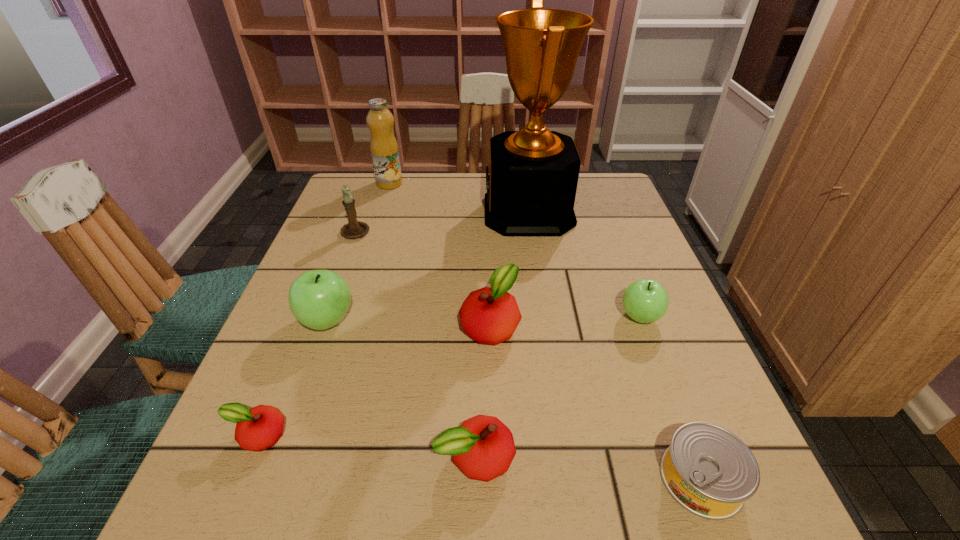
Locate an element on the screen. The height and width of the screenshot is (540, 960). the tallest object is located at coordinates (531, 181).

This screenshot has height=540, width=960. I want to click on trophy cup, so click(x=531, y=181).

Identify the location of fruit juice. (384, 149).

The width and height of the screenshot is (960, 540). In order to click on candle holder in this screenshot , I will do `click(354, 229)`.

The height and width of the screenshot is (540, 960). Find the location of `the bigger green apple`. the bigger green apple is located at coordinates pos(319,299).

This screenshot has height=540, width=960. I want to click on the tallest apple, so click(319, 299).

Locate an element on the screen. The height and width of the screenshot is (540, 960). the biggest red apple is located at coordinates (490, 315).

Locate an element on the screen. The image size is (960, 540). the rightmost apple is located at coordinates (646, 300).

The image size is (960, 540). What are the coordinates of `the smaller green apple` in the screenshot? It's located at [x=646, y=300].

This screenshot has width=960, height=540. In order to click on the second smallest red apple in this screenshot , I will do pos(483,447).